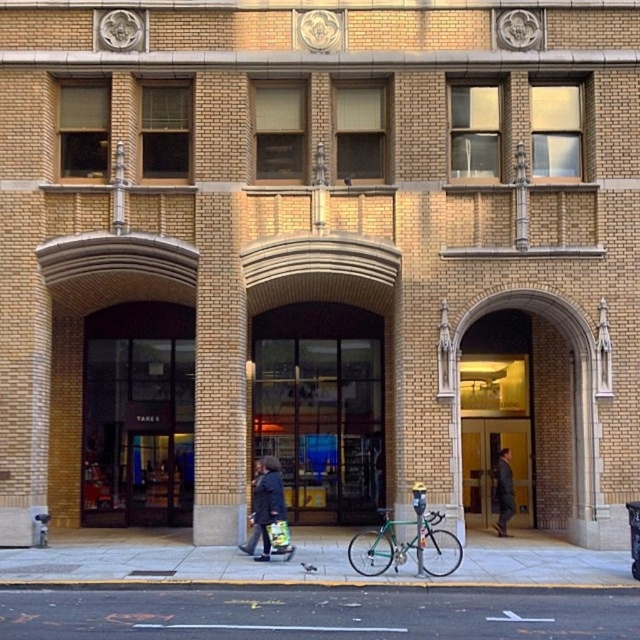
Between dark blue coat at center and dark gray coat at center, which one is positioned lower?

Positioned lower is dark gray coat at center.

Image resolution: width=640 pixels, height=640 pixels. Identify the location of dark blue coat at center. (266, 504).

Who is more forward, [269,465] or [497,477]?

Point [269,465] is more forward.

Locate an element on the screen. Image resolution: width=640 pixels, height=640 pixels. dark blue coat at center is located at coordinates (266, 504).

Who is lower down, gray asphalt at lower center or smooth concrete sidewalk at center?

smooth concrete sidewalk at center

Consider the image. Is gray asphalt at lower center taller than smooth concrete sidewalk at center?

No.

This screenshot has height=640, width=640. Describe the element at coordinates (317, 612) in the screenshot. I see `gray asphalt at lower center` at that location.

What are the coordinates of `gray asphalt at lower center` in the screenshot? It's located at (317, 612).

Based on the photo, is gray asphalt at lower center wider than dark blue coat at center?

Yes, gray asphalt at lower center is wider than dark blue coat at center.

Consider the image. Is gray asphalt at lower center positioned in front of dark blue coat at center?

Yes, gray asphalt at lower center is in front of dark blue coat at center.

Identify the location of gray asphalt at lower center. The width and height of the screenshot is (640, 640). (317, 612).